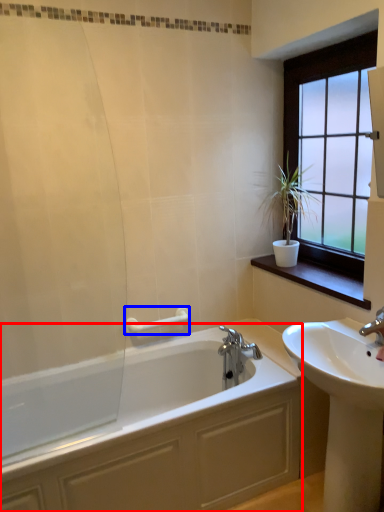
Question: Which point is further to the camera, bathtub (highlighted by a red box) or towel bar (highlighted by a blue box)?

Choices:
 (A) bathtub
 (B) towel bar

Answer: (B)